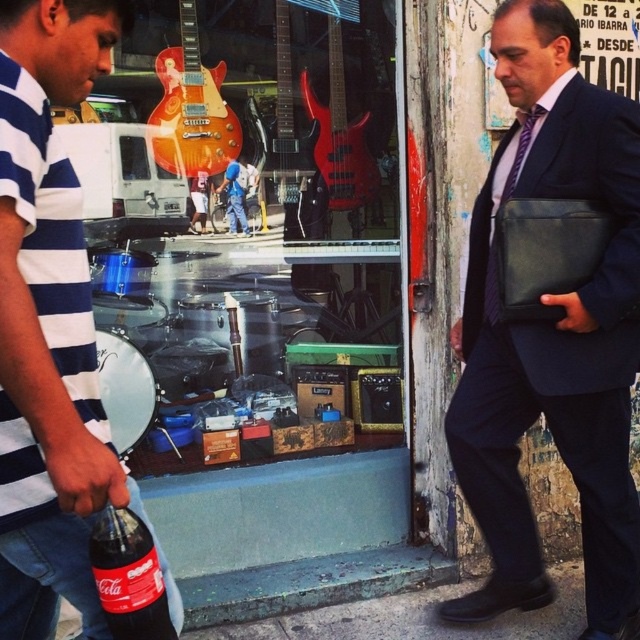
Is green concrete pavement at lower center above purple striped tie at right?

No, green concrete pavement at lower center is not above purple striped tie at right.

Image resolution: width=640 pixels, height=640 pixels. Describe the element at coordinates (419, 618) in the screenshot. I see `green concrete pavement at lower center` at that location.

The height and width of the screenshot is (640, 640). What are the coordinates of `green concrete pavement at lower center` in the screenshot? It's located at (419, 618).

From the picture: Which is more to the right, matte black briefcase at center or purple striped tie at right?

Positioned to the right is matte black briefcase at center.

Looking at this image, how distant is matte black briefcase at center from purple striped tie at right?

matte black briefcase at center and purple striped tie at right are 7.66 inches apart from each other.

Image resolution: width=640 pixels, height=640 pixels. What do you see at coordinates (552, 333) in the screenshot? I see `matte black briefcase at center` at bounding box center [552, 333].

The image size is (640, 640). In order to click on matte black briefcase at center in this screenshot , I will do click(552, 333).

Can you confirm if striped cotton shirt at left is positioned below green concrete pavement at lower center?

Incorrect, striped cotton shirt at left is not positioned below green concrete pavement at lower center.

Which is behind, point (61, 550) or point (180, 637)?

Point (180, 637)

The width and height of the screenshot is (640, 640). I want to click on striped cotton shirt at left, so click(49, 323).